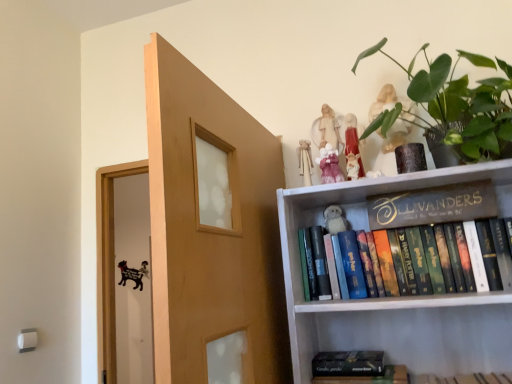
Identify the location of free spot above gold metallic sign at upper right, the third book from the bottom (from a real-world perspective). This screenshot has height=384, width=512. (418, 191).